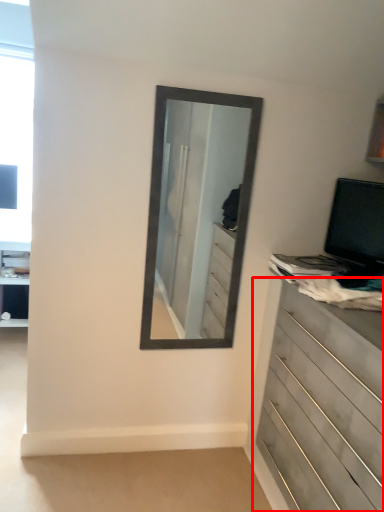
Question: Where is chest of drawers (annotated by the red box) located in relation to computer monitor in the image?

Choices:
 (A) left
 (B) right

Answer: (A)